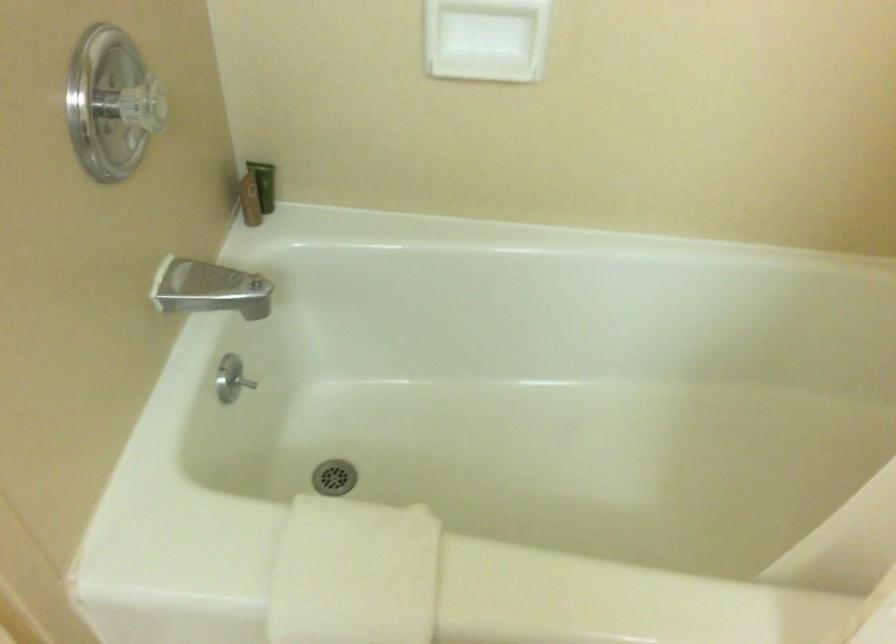
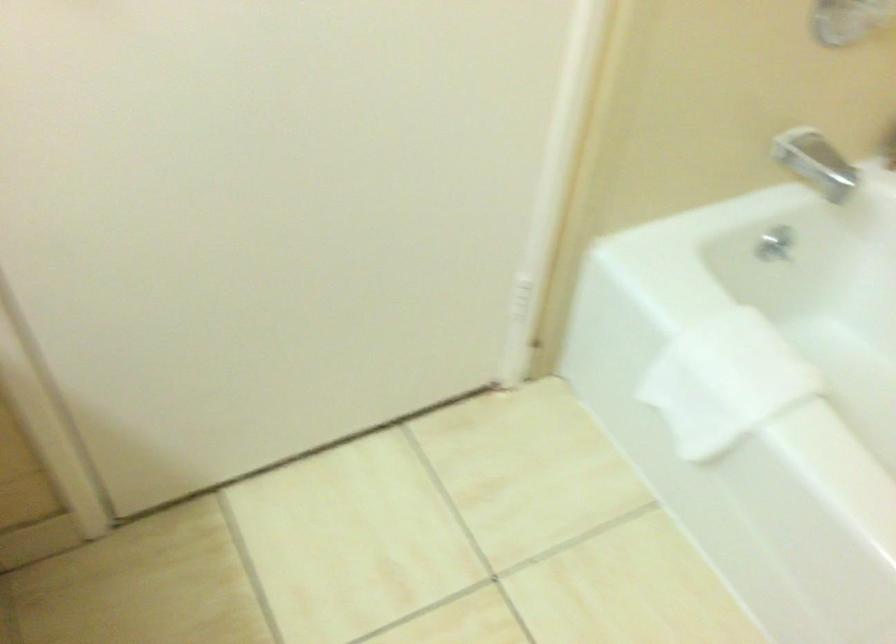
Question: The first image is from the beginning of the video and the second image is from the end. How did the camera likely rotate when shooting the video?

Choices:
 (A) Left
 (B) Right
 (C) Up
 (D) Down

Answer: (A)